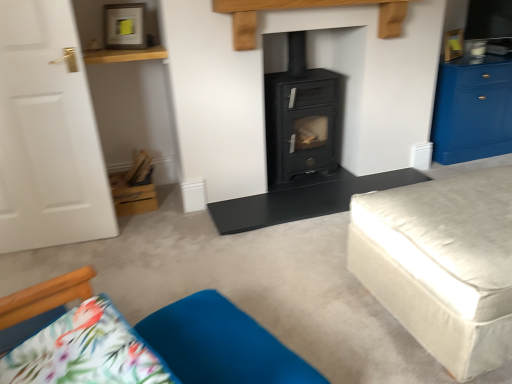
Locate an element on the screen. This screenshot has height=384, width=512. free space in front of black matte wood burning stove at center is located at coordinates (309, 194).